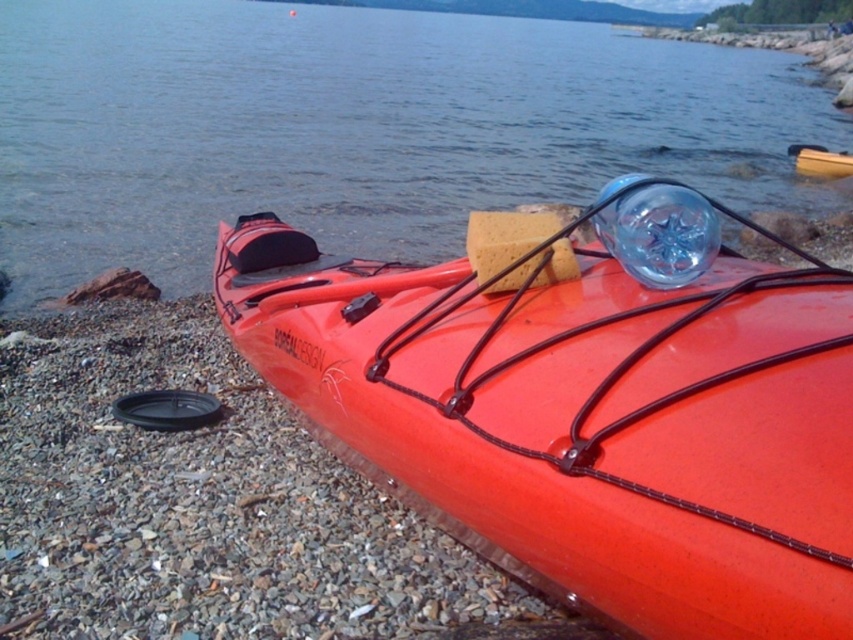
Question: Does transparent plastic water at upper center have a larger size compared to orange plastic canoe at center?

Choices:
 (A) no
 (B) yes

Answer: (B)

Question: Does orange matte kayak at center appear under orange plastic canoe at center?

Choices:
 (A) no
 (B) yes

Answer: (B)

Question: Which object is farther from the camera taking this photo?

Choices:
 (A) transparent plastic water at upper center
 (B) orange matte kayak at center

Answer: (A)

Question: Which point appears closest to the camera in this image?

Choices:
 (A) (821, 161)
 (B) (793, 532)
 (C) (463, 70)

Answer: (B)

Question: Which point appears farthest from the camera in this image?

Choices:
 (A) (165, 22)
 (B) (782, 467)
 (C) (848, 170)

Answer: (A)

Question: Is orange matte kayak at center positioned in front of transparent plastic water at upper center?

Choices:
 (A) yes
 (B) no

Answer: (A)